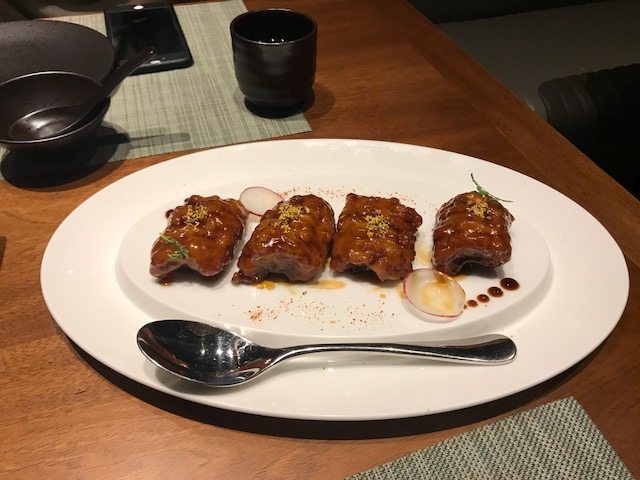
Locate an element on the screen. This screenshot has height=480, width=640. inside of bowl is located at coordinates (34, 97).